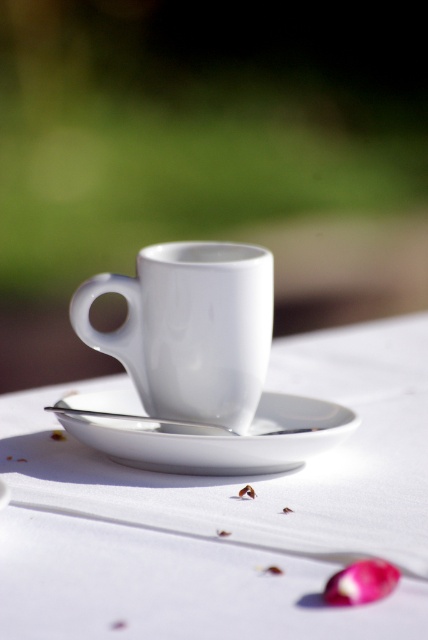
Question: Is the position of white glossy saucer at center more distant than that of pink glossy onion at lower right?

Choices:
 (A) yes
 (B) no

Answer: (A)

Question: Can you confirm if white glossy saucer at center is smaller than pink glossy onion at lower right?

Choices:
 (A) no
 (B) yes

Answer: (A)

Question: Is white glossy mug at center smaller than silver metallic spoon at center?

Choices:
 (A) no
 (B) yes

Answer: (A)

Question: Which point is closer to the camera taking this photo?

Choices:
 (A) (118, 346)
 (B) (389, 577)
 (C) (109, 410)

Answer: (B)

Question: Which of the following is the closest to the observer?

Choices:
 (A) (86, 410)
 (B) (109, 454)
 (C) (178, 356)
 (D) (360, 568)

Answer: (D)

Question: Among these objects, which one is farthest from the camera?

Choices:
 (A) white glossy mug at center
 (B) pink glossy onion at lower right
 (C) white ceramic cup at center

Answer: (A)